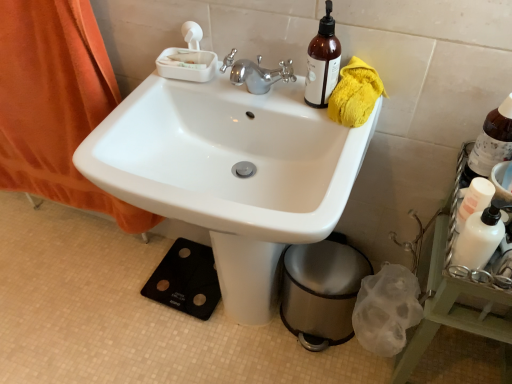
You are a GUI agent. You are given a task and a screenshot of the screen. Output one action in this format:
    pyautogui.click(x=<x>, y=<y>)
    Task: Click on the vacant space that is in between white glossy sink at center and orange fabric curtain at left
    This screenshot has width=512, height=384.
    Given the screenshot: What is the action you would take?
    pyautogui.click(x=99, y=271)